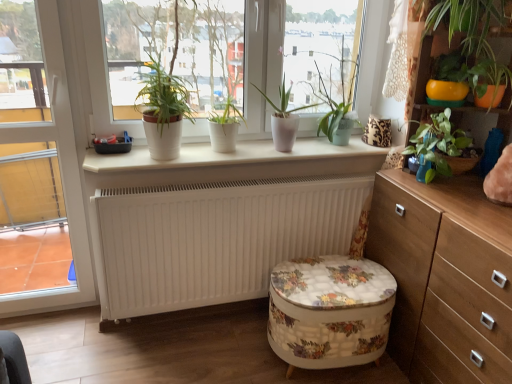
Identify the location of free region under green glossy plant at upper right, which is the fourth houseplant in left-to-right order (from a real-world perspective). This screenshot has width=512, height=384. (420, 186).